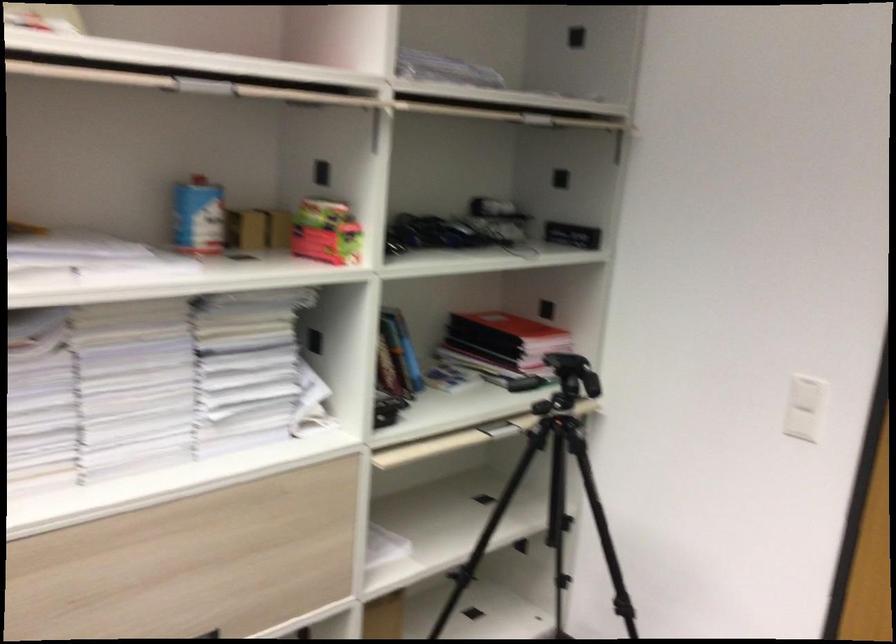
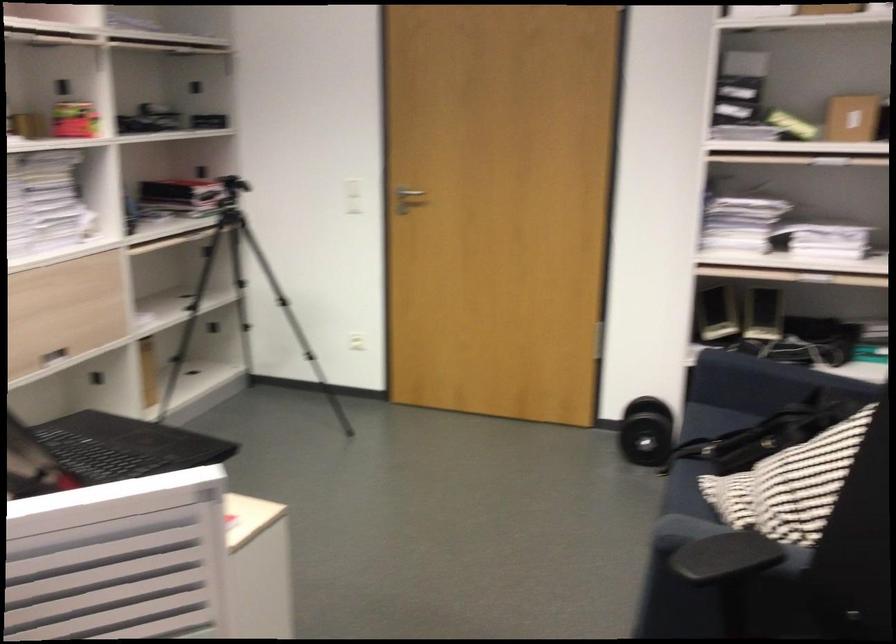
Question: In a continuous first-person perspective shot, in which direction is the camera moving?

Choices:
 (A) Left
 (B) Right
 (C) Forward
 (D) Backward

Answer: (D)